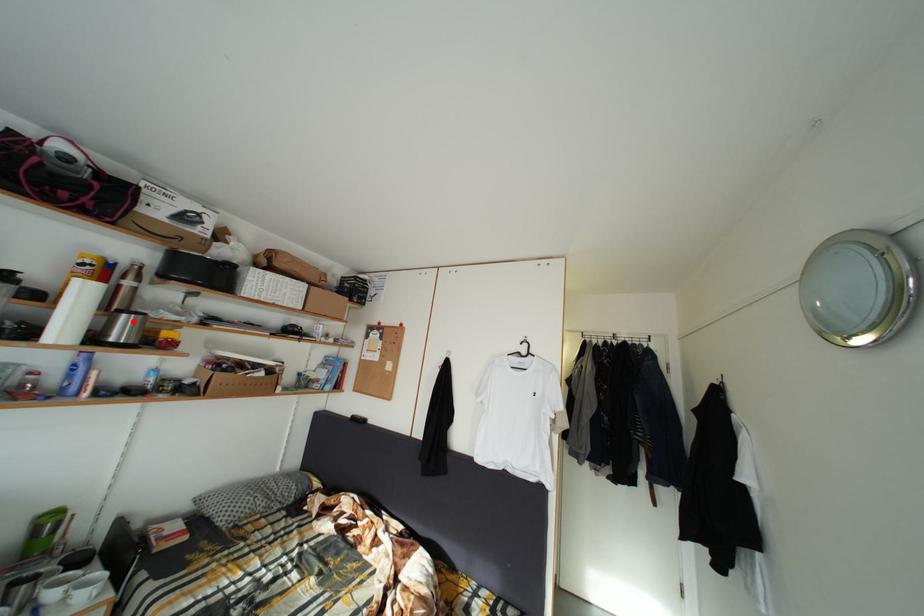
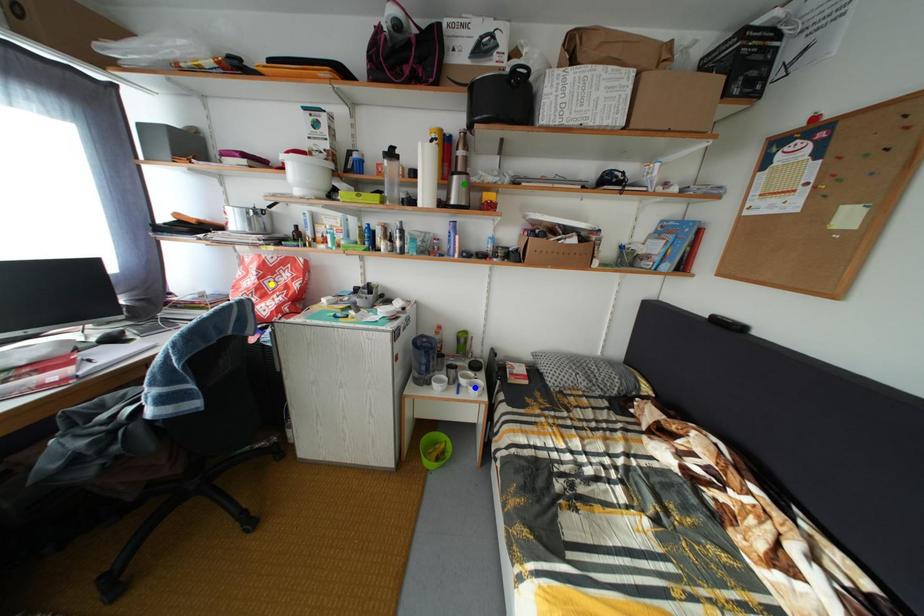
Question: I am providing you with two images of the same scene from different viewpoints. A red point is marked on the first image. You are given multiple points on the second image. Can you choose the point in image 2 that corresponds to the point in image 1?

Choices:
 (A) blue point
 (B) yellow point
 (C) green point

Answer: (C)